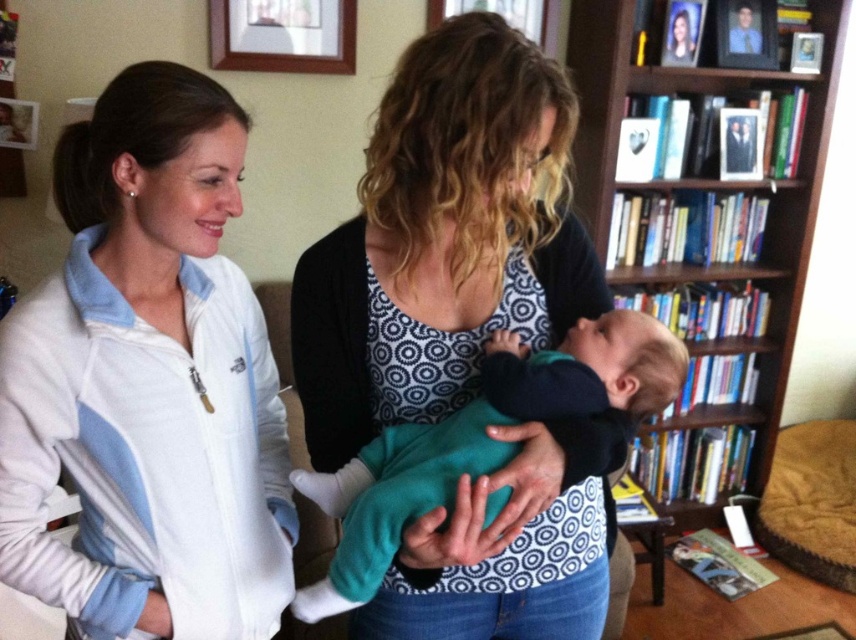
Is point (36, 564) farther from camera compared to point (670, 500)?

No, (36, 564) is in front of (670, 500).

Between white fleece jacket at left and brown wooden bookcase at upper right, which one is positioned higher?

Positioned higher is brown wooden bookcase at upper right.

Is point (82, 186) positioned after point (580, 172)?

No, (82, 186) is in front of (580, 172).

The image size is (856, 640). I want to click on white fleece jacket at left, so click(x=147, y=381).

Looking at this image, does wooden picture frame at upper center have a greater width compared to matte blue photo frame at upper right?

Correct, the width of wooden picture frame at upper center exceeds that of matte blue photo frame at upper right.

Is wooden picture frame at upper center closer to the viewer compared to matte blue photo frame at upper right?

Yes, it is.

Measure the distance between point (256, 4) and camera.

Point (256, 4) is 7.74 feet from camera.

Find the location of a particular element. wooden picture frame at upper center is located at coordinates (282, 35).

Does matte blue tank top at center have a greater width compared to brown wooden bookcase at upper right?

No, matte blue tank top at center is not wider than brown wooden bookcase at upper right.

Between point (514, 45) and point (580, 172), which one is positioned behind?

Positioned behind is point (580, 172).

Does point (459, 401) come closer to viewer compared to point (687, 90)?

Yes, point (459, 401) is closer to viewer.

Identify the location of matte blue tank top at center. The image size is (856, 640). (443, 240).